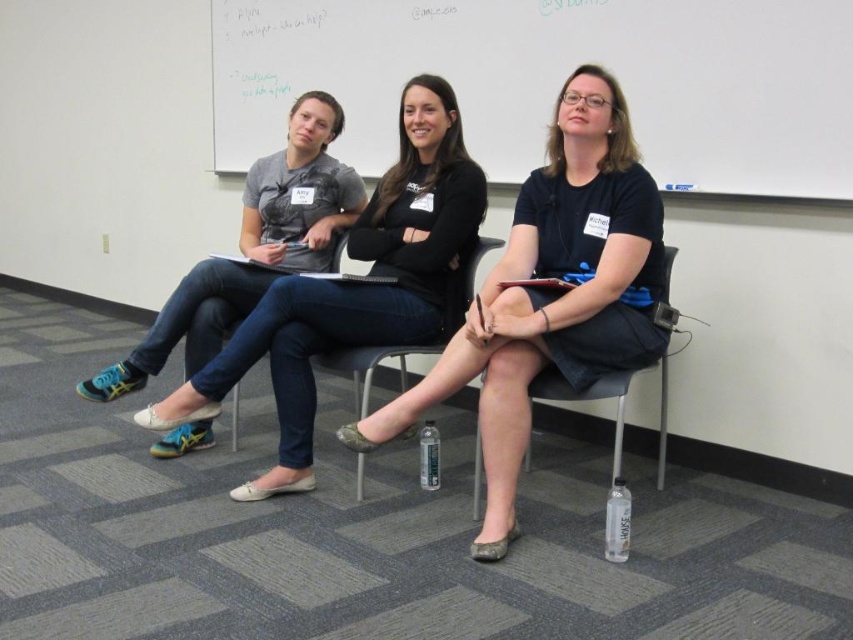
Question: Does whiteboard at upper center have a greater width compared to matte black dress at center?

Choices:
 (A) no
 (B) yes

Answer: (B)

Question: Does whiteboard at upper center have a larger size compared to denim jeans at center?

Choices:
 (A) yes
 (B) no

Answer: (A)

Question: Which point is closer to the camera?

Choices:
 (A) (560, 387)
 (B) (299, 52)
 (C) (370, 358)
 (D) (437, 291)

Answer: (A)

Question: Which of the following is the closest to the observer?

Choices:
 (A) click(194, 346)
 (B) click(701, 160)
 (C) click(659, 481)
 (D) click(437, 156)

Answer: (B)

Question: Is whiteboard at upper center bigger than denim jeans at center?

Choices:
 (A) no
 (B) yes

Answer: (B)

Question: Estimate the real-world distances between objects in this image. Which object is farther from the matte gray t-shirt at center?

Choices:
 (A) black fabric chair at center
 (B) whiteboard at upper center
 (C) metallic silver chair at center

Answer: (A)